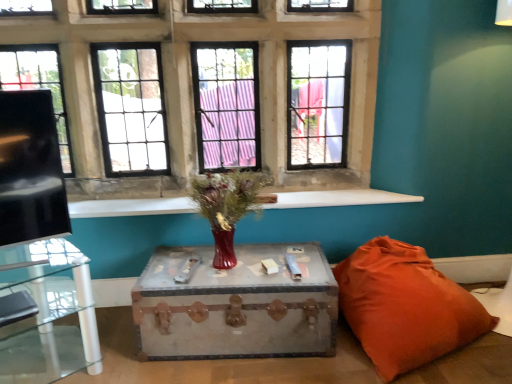
This screenshot has width=512, height=384. I want to click on free point below matte glass vase at center (from a real-world perspective), so click(229, 268).